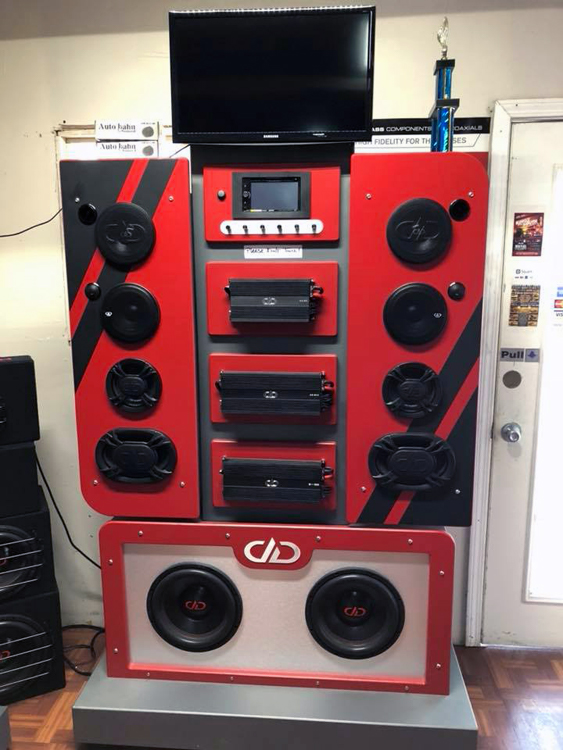
Where is `floor`? floor is located at coordinates (497, 690).